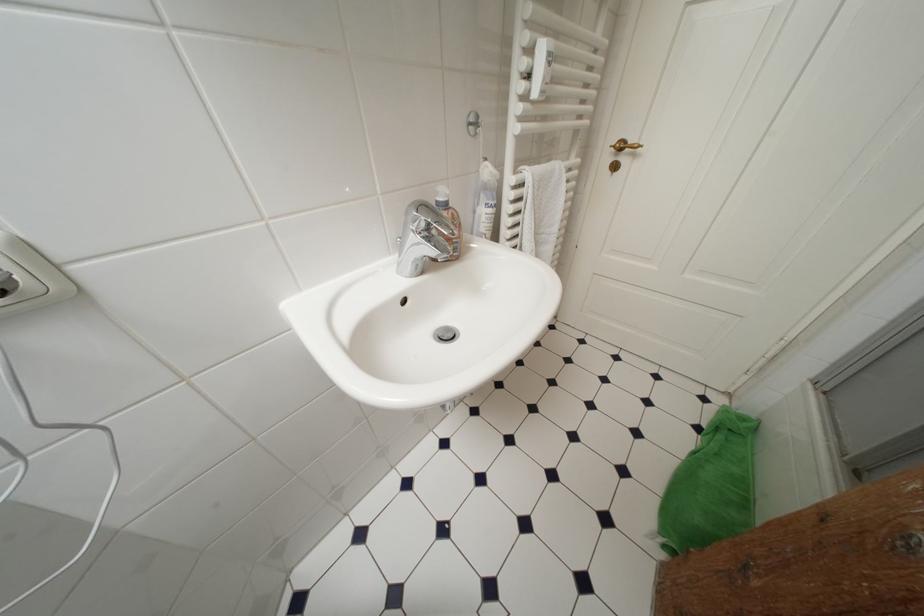
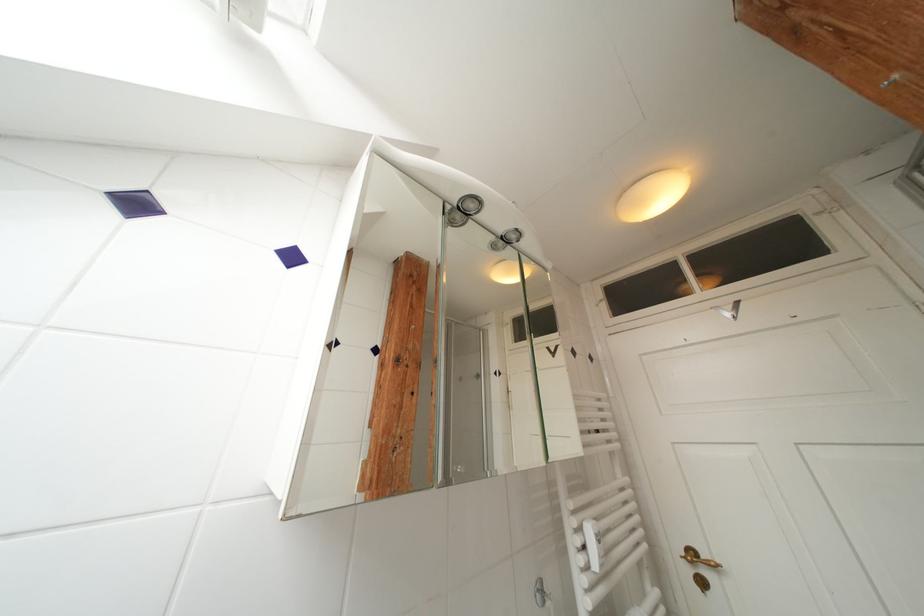
Where in the second image is the point corresponding to pixel 627 148 from the first image?

(699, 557)